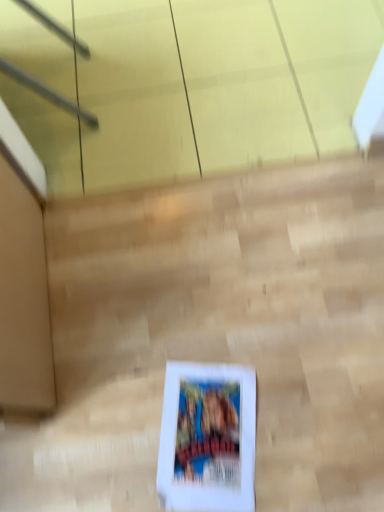
Image resolution: width=384 pixels, height=512 pixels. What are the coordinates of `free location above white cardboard box at center (from a real-world perspective)` in the screenshot? It's located at (198, 357).